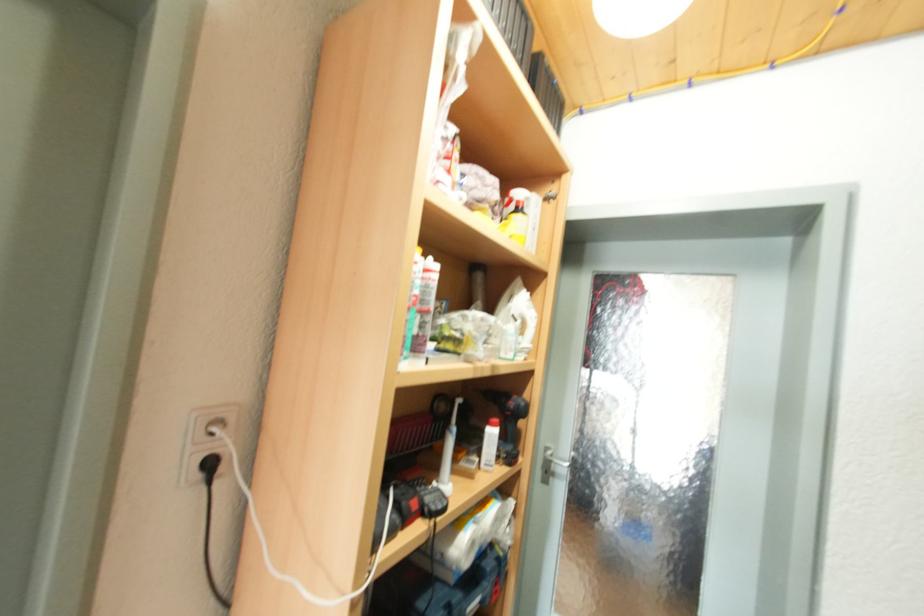
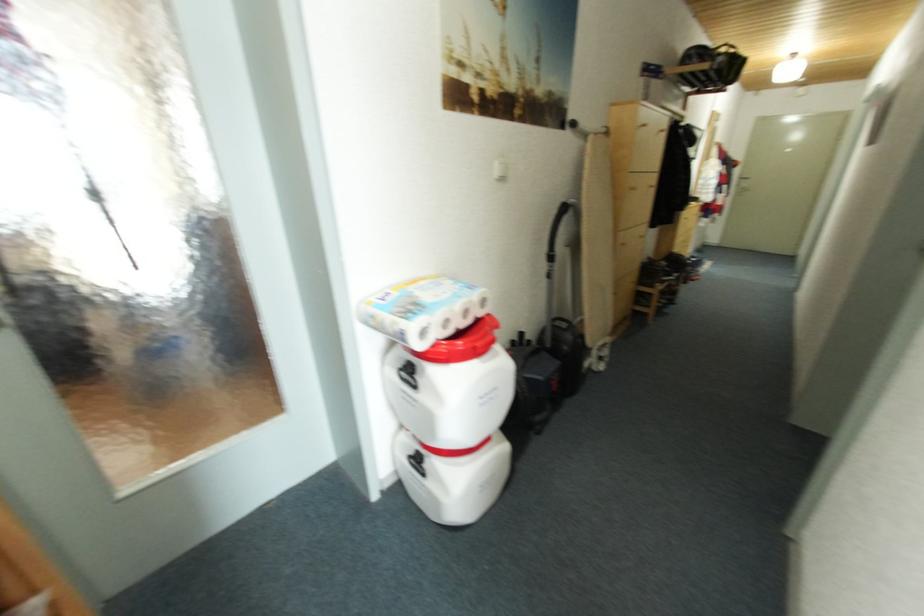
The first image is from the beginning of the video and the second image is from the end. How did the camera likely rotate when shooting the video?

The camera's rotation is toward right-down.